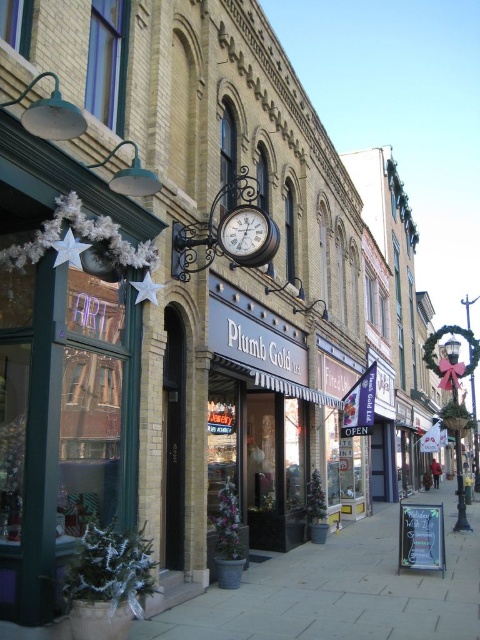
Question: Is smooth concrete sidewalk at center smaller than matte black clock at center?

Choices:
 (A) yes
 (B) no

Answer: (B)

Question: Which of the following is the farthest from the observer?

Choices:
 (A) (218, 246)
 (B) (327, 596)

Answer: (A)

Question: Can you confirm if smooth concrete sidewalk at center is wider than matte black clock at center?

Choices:
 (A) yes
 (B) no

Answer: (A)

Question: Is the position of smooth concrete sidewalk at center more distant than that of matte black clock at center?

Choices:
 (A) yes
 (B) no

Answer: (B)

Question: Which of the following is the farthest from the observer?

Choices:
 (A) (241, 246)
 (B) (216, 634)

Answer: (A)